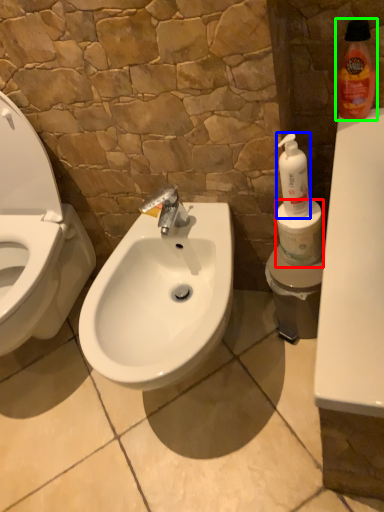
Question: Which object is the farthest from toilet paper (highlighted by a red box)? Choose among these: cleaning product (highlighted by a blue box) or cleaning product (highlighted by a green box).

Choices:
 (A) cleaning product
 (B) cleaning product

Answer: (B)